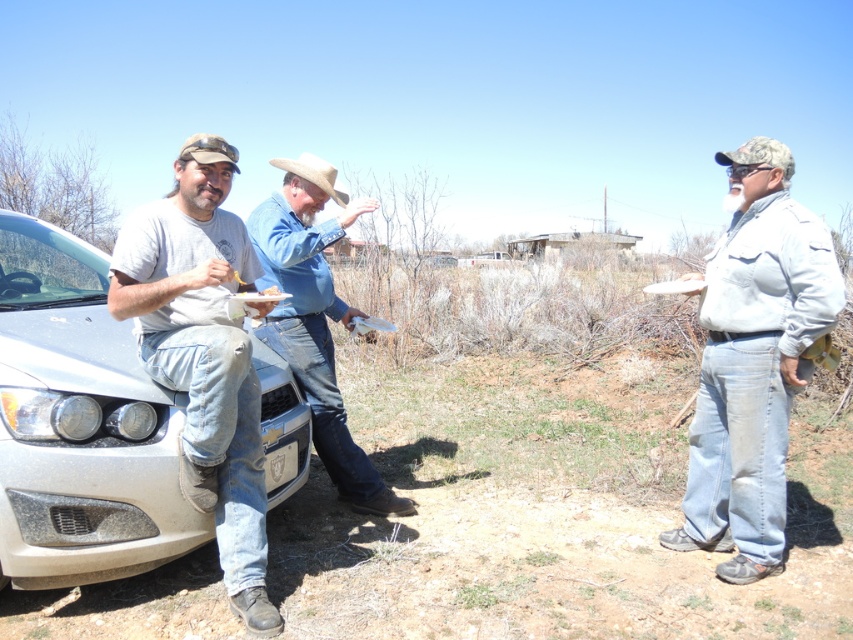
Is point (782, 244) behind point (268, 269)?

No.

Between denim jacket at right and blue denim jeans at center, which one appears on the left side from the viewer's perspective?

Positioned to the left is blue denim jeans at center.

Is point (770, 406) farther from camera compared to point (259, 204)?

No, (770, 406) is closer to viewer.

At what (x,y) coordinates should I click in order to perform the action: click on denim jacket at right. Please return your answer as a coordinate pair (x, y). Looking at the image, I should click on (753, 360).

Does blue denim jeans at center have a lesser width compared to beige felt cowboy hat at center?

Yes.

Does blue denim jeans at center have a larger size compared to beige felt cowboy hat at center?

Actually, blue denim jeans at center might be smaller than beige felt cowboy hat at center.

The width and height of the screenshot is (853, 640). Find the location of `blue denim jeans at center`. blue denim jeans at center is located at coordinates (315, 317).

Is point (51, 412) less distant than point (358, 497)?

Yes, it is.

The height and width of the screenshot is (640, 853). Identify the location of silver metallic car at left. (79, 424).

The height and width of the screenshot is (640, 853). What are the coordinates of `silver metallic car at left` in the screenshot? It's located at (79, 424).